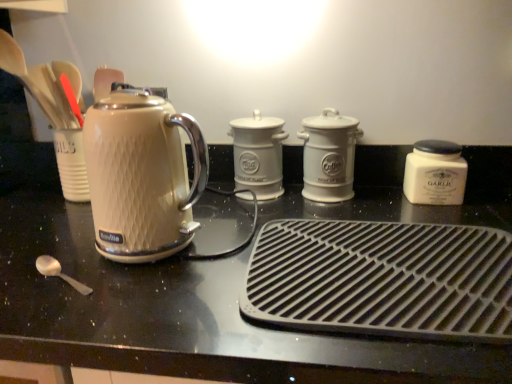
Locate an element on the screen. unoccupied area in front of white ceramic jar at right, which is counted as the third kitchen appliance, starting from the back is located at coordinates (464, 212).